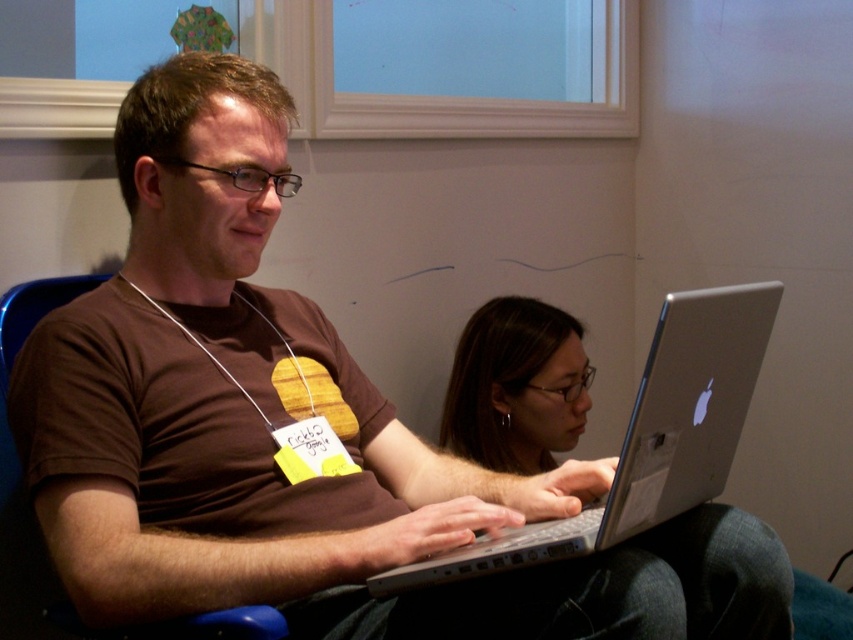
Is matte black hair at center thinner than blue plastic chair at left?

In fact, matte black hair at center might be wider than blue plastic chair at left.

Between point (527, 337) and point (16, 296), which one is positioned in front?

Point (16, 296) is more forward.

Does point (511, 403) come behind point (47, 611)?

Yes, it is behind point (47, 611).

The image size is (853, 640). I want to click on matte black hair at center, so click(x=515, y=387).

Image resolution: width=853 pixels, height=640 pixels. Identify the location of silver metallic laptop at center. (647, 436).

Does silver metallic laptop at center have a greater height compared to matte black hair at center?

In fact, silver metallic laptop at center may be shorter than matte black hair at center.

Where is `silver metallic laptop at center`? silver metallic laptop at center is located at coordinates (647, 436).

Locate an element on the screen. silver metallic laptop at center is located at coordinates click(x=647, y=436).

Is silver metallic laptop at center taller than blue plastic chair at left?

Yes.

Which is behind, point (567, 390) or point (28, 291)?

Point (567, 390)

Locate an element on the screen. silver metallic laptop at center is located at coordinates (647, 436).